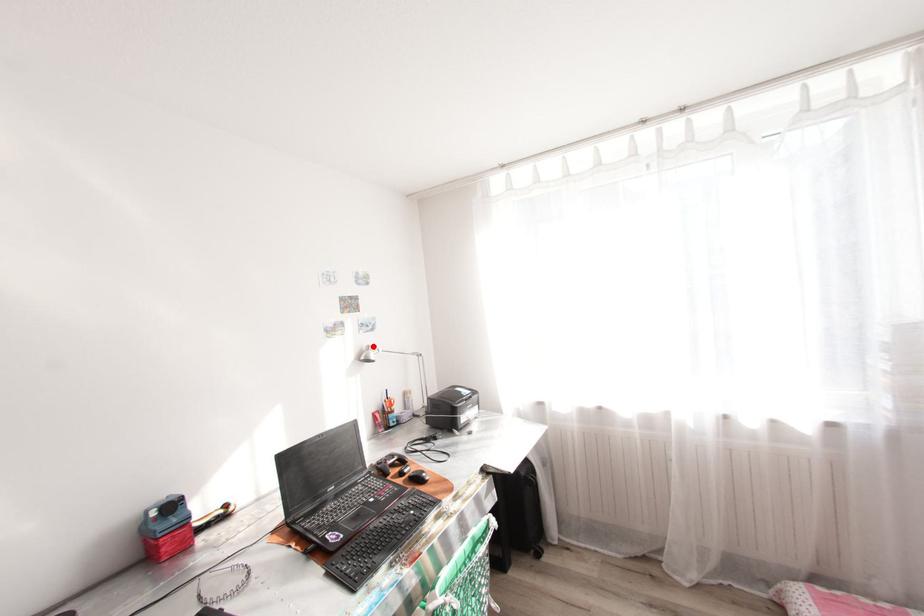
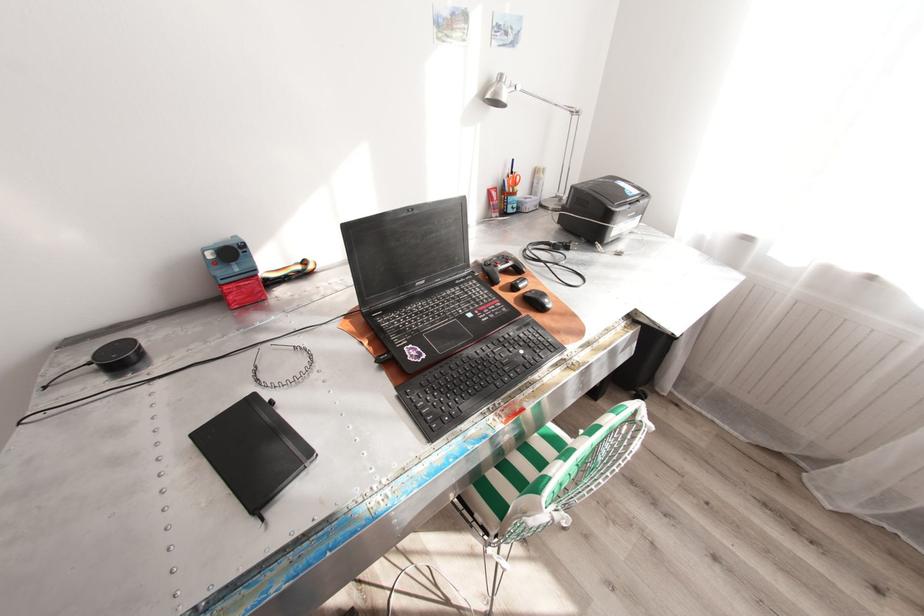
In the second image, find the point that corresponds to the highlighted location in the first image.

(505, 76)